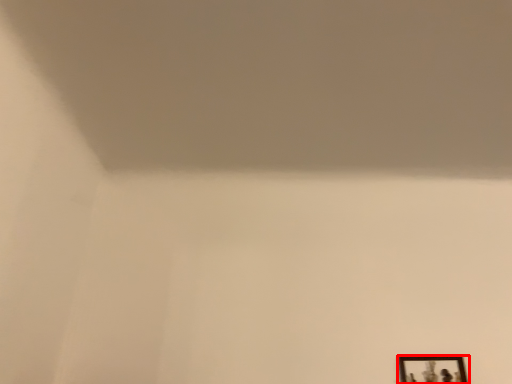
Question: From the image's perspective, what is the correct spatial relationship of picture frame (annotated by the red box) in relation to wide?

Choices:
 (A) below
 (B) above

Answer: (A)